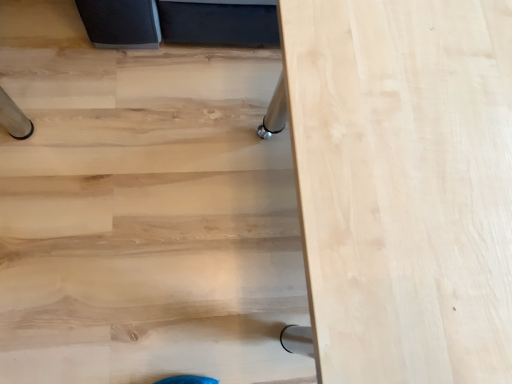
Question: From a real-world perspective, is natural wood table at center physically above light wood table at lower right?

Choices:
 (A) no
 (B) yes

Answer: (B)

Question: Does natural wood table at center have a lesser width compared to light wood table at lower right?

Choices:
 (A) yes
 (B) no

Answer: (A)

Question: Is natural wood table at center next to light wood table at lower right and touching it?

Choices:
 (A) yes
 (B) no

Answer: (B)

Question: Is natural wood table at center positioned in front of light wood table at lower right?

Choices:
 (A) no
 (B) yes

Answer: (B)

Question: Is natural wood table at center outside light wood table at lower right?

Choices:
 (A) no
 (B) yes

Answer: (B)

Question: Considering the relative sizes of natural wood table at center and light wood table at lower right in the image provided, is natural wood table at center shorter than light wood table at lower right?

Choices:
 (A) no
 (B) yes

Answer: (A)

Question: Is light wood table at lower right to the right of natural wood table at center from the viewer's perspective?

Choices:
 (A) yes
 (B) no

Answer: (B)

Question: Can you confirm if light wood table at lower right is bigger than natural wood table at center?

Choices:
 (A) yes
 (B) no

Answer: (B)

Question: Does light wood table at lower right have a lesser width compared to natural wood table at center?

Choices:
 (A) no
 (B) yes

Answer: (A)

Question: Is light wood table at lower right facing towards natural wood table at center?

Choices:
 (A) no
 (B) yes

Answer: (A)

Question: Is light wood table at lower right closer to the viewer compared to natural wood table at center?

Choices:
 (A) no
 (B) yes

Answer: (A)

Question: Can you see light wood table at lower right touching natural wood table at center?

Choices:
 (A) yes
 (B) no

Answer: (B)

Question: Considering the positions of light wood table at lower right and natural wood table at center in the image, is light wood table at lower right taller or shorter than natural wood table at center?

Choices:
 (A) tall
 (B) short

Answer: (B)